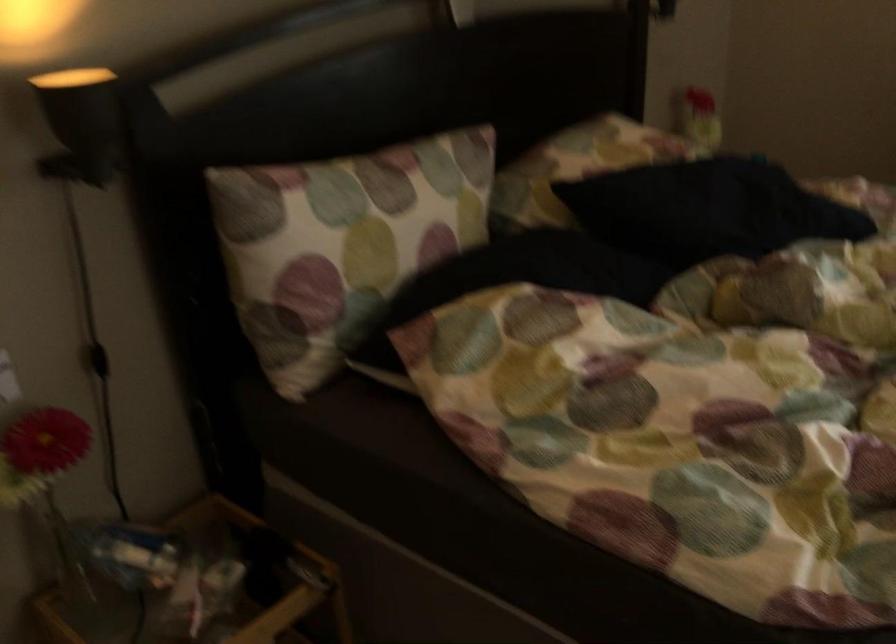
Find where to push the black light switch. Please return your answer as a coordinate pair (x, y).

(98, 360)